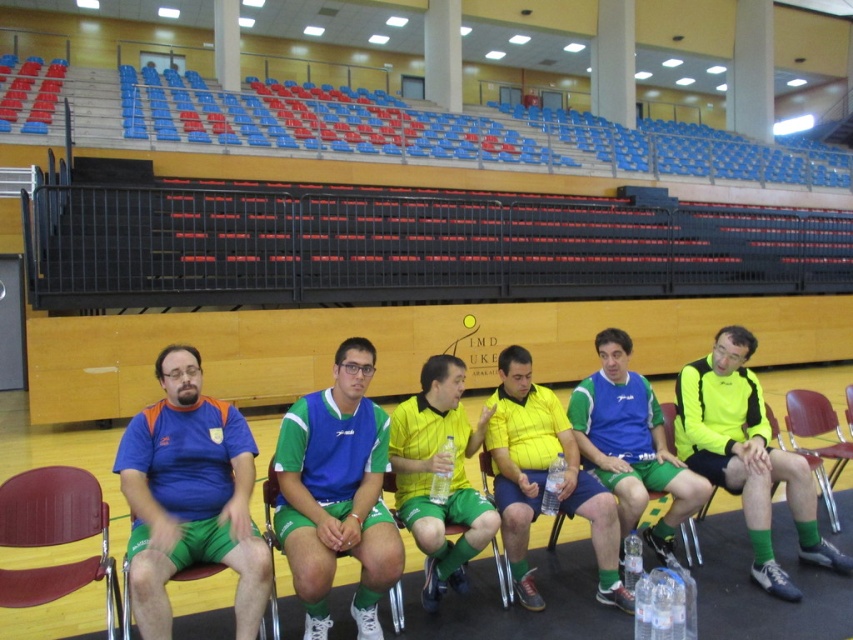
Who is more forward, (x=456, y=544) or (x=601, y=330)?

Point (x=456, y=544) is more forward.

Is point (436, 451) more distant than point (611, 356)?

No.

Who is more distant from viewer, (425,408) or (601,349)?

Point (601,349)

What are the coordinates of `yellow matte shirt at center` in the screenshot? It's located at (437, 474).

Which of these two, blue fabric shirt at left or yellow matte shirt at center, stands shorter?

Standing shorter between the two is blue fabric shirt at left.

Is blue fabric shirt at left bigger than yellow matte shirt at center?

Yes, blue fabric shirt at left is bigger than yellow matte shirt at center.

Where is `blue fabric shirt at left`? blue fabric shirt at left is located at coordinates (189, 497).

At what (x,y) coordinates should I click in order to perform the action: click on blue fabric shirt at left. Please return your answer as a coordinate pair (x, y). Looking at the image, I should click on click(x=189, y=497).

Can you confirm if leather-like maroon chair at lower left is bigger than wooden chair at center?

Actually, leather-like maroon chair at lower left might be smaller than wooden chair at center.

Does point (76, 573) come behind point (805, 445)?

No, (76, 573) is in front of (805, 445).

At what (x,y) coordinates should I click in order to perform the action: click on leather-like maroon chair at lower left. Please return your answer as a coordinate pair (x, y). Image resolution: width=853 pixels, height=640 pixels. Looking at the image, I should click on (55, 536).